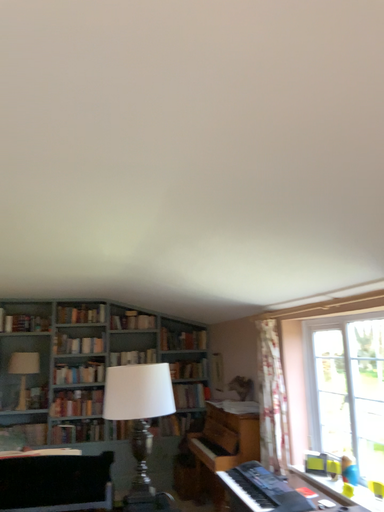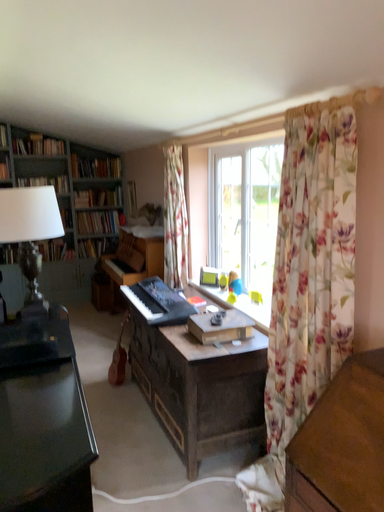
Question: How did the camera likely rotate when shooting the video?

Choices:
 (A) rotated upward
 (B) rotated downward

Answer: (B)